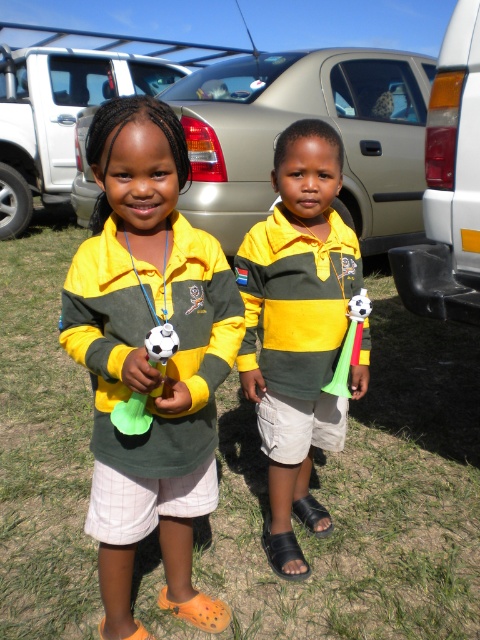
Is point (336, 134) farther from camera compared to point (127, 54)?

That is False.

Which is in front, point (301, 522) or point (56, 76)?

Point (301, 522) is more forward.

Find the location of `yellow-green striped polo shirt at center`. yellow-green striped polo shirt at center is located at coordinates (298, 328).

Which is below, white matte soccer ball at left or white plastic soccer ball at right?

white matte soccer ball at left is below.

Does white matte soccer ball at left appear under white plastic soccer ball at right?

Indeed, white matte soccer ball at left is positioned under white plastic soccer ball at right.

Image resolution: width=480 pixels, height=640 pixels. What are the coordinates of `white matte soccer ball at left` in the screenshot? It's located at (132, 413).

Can you confirm if white matte bumper at lower right is smaller than silver metallic car at center?

Yes, white matte bumper at lower right is smaller than silver metallic car at center.

What do you see at coordinates (448, 184) in the screenshot?
I see `white matte bumper at lower right` at bounding box center [448, 184].

The image size is (480, 640). I want to click on white matte bumper at lower right, so tap(448, 184).